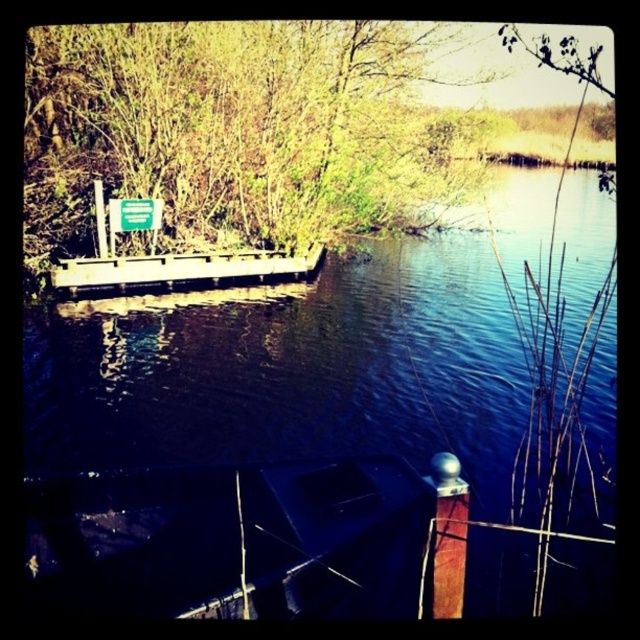
Question: Which point is closer to the camera taking this photo?

Choices:
 (A) (67, 268)
 (B) (333, 435)

Answer: (B)

Question: In this image, where is blue water at center located relative to wooden dock at center?

Choices:
 (A) below
 (B) above

Answer: (B)

Question: Is blue water at center below wooden dock at center?

Choices:
 (A) no
 (B) yes

Answer: (A)

Question: Which object is farther from the camera taking this photo?

Choices:
 (A) blue water at center
 (B) wooden dock at center

Answer: (B)

Question: Can you confirm if blue water at center is positioned to the right of wooden dock at center?

Choices:
 (A) no
 (B) yes

Answer: (B)